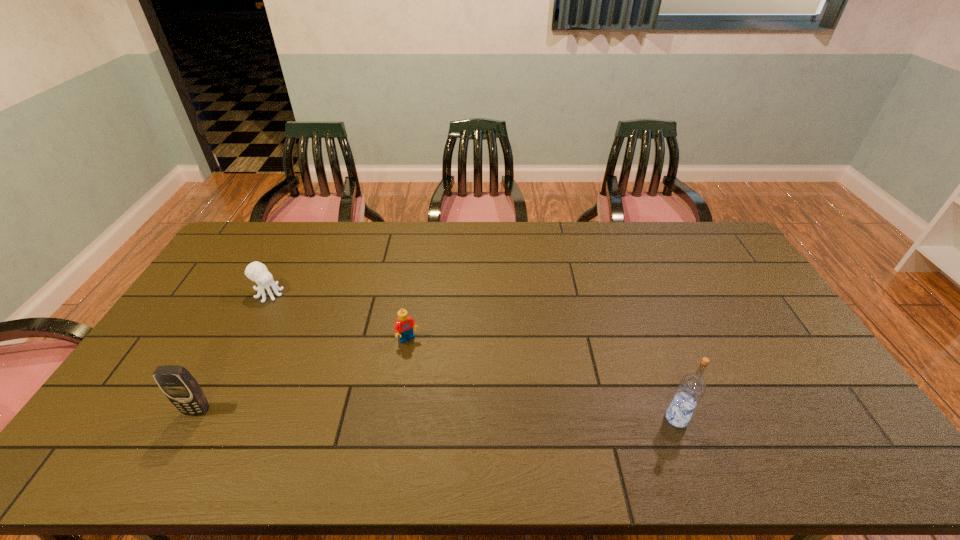
Where is `vacant area situated 0.390m on the front-facing side of the farthest object`? The width and height of the screenshot is (960, 540). vacant area situated 0.390m on the front-facing side of the farthest object is located at coordinates (364, 350).

Find the location of a particular element. This screenshot has width=960, height=540. vacant space located on the front-facing side of the farthest object is located at coordinates (322, 325).

I want to click on free location located 0.300m on the front-facing side of the farthest object, so click(x=342, y=337).

This screenshot has height=540, width=960. Find the location of `cellular telephone that is at the near edge`. cellular telephone that is at the near edge is located at coordinates (180, 387).

The width and height of the screenshot is (960, 540). Find the location of `vodka that is at the near edge`. vodka that is at the near edge is located at coordinates (691, 388).

In the image, there is a desktop. Identify the location of vacant area at the far edge. (660, 224).

In the image, there is a desktop. Where is `blank space at the near edge`? blank space at the near edge is located at coordinates (774, 421).

I want to click on vacant space at the left edge of the desktop, so click(x=178, y=329).

The image size is (960, 540). In the image, there is a desktop. What are the coordinates of `vacant area at the right edge` in the screenshot? It's located at (735, 281).

In the image, there is a desktop. Where is `vacant space at the far left corner`? The height and width of the screenshot is (540, 960). vacant space at the far left corner is located at coordinates (284, 222).